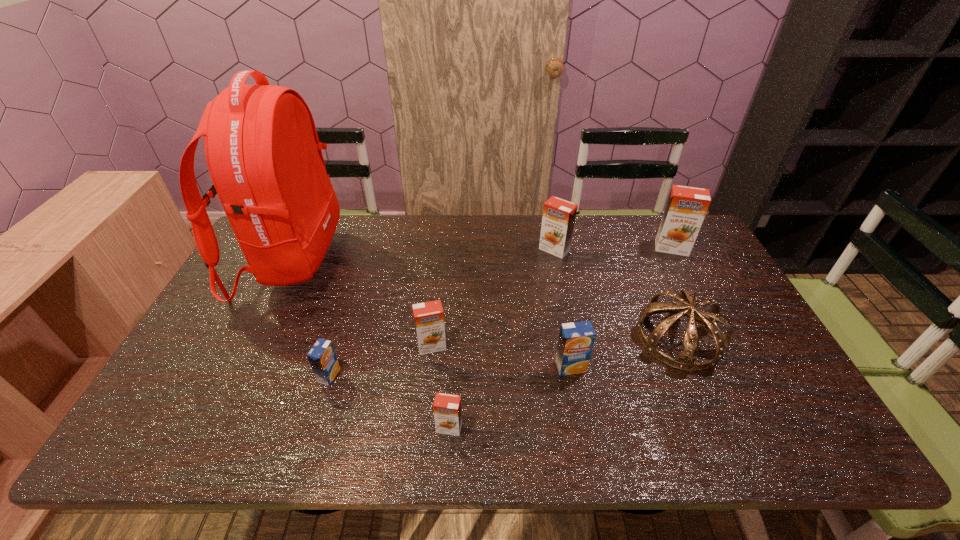
Find the location of a particular element. The width and height of the screenshot is (960, 540). empty space that is in between the second smallest orange orange juice and the nearest orange juice is located at coordinates (441, 387).

At what (x,y) coordinates should I click in order to perform the action: click on empty space that is in between the third farthest orange juice and the biggest orange orange juice. Please return your answer as a coordinate pair (x, y). The width and height of the screenshot is (960, 540). Looking at the image, I should click on (552, 297).

In order to click on empty space that is in between the brown tiara and the third orange orange juice from left to right in this screenshot , I will do `click(617, 294)`.

Point out which object is positioned as the third nearest to the nearest orange juice. Please provide its 2D coordinates. Your answer should be formatted as a tuple, i.e. [(x, y)], where the tuple contains the x and y coordinates of a point satisfying the conditions above.

[(322, 357)]

Identify which object is located as the seventh nearest to the right blue orange_juice. Please provide its 2D coordinates. Your answer should be formatted as a tuple, i.e. [(x, y)], where the tuple contains the x and y coordinates of a point satisfying the conditions above.

[(262, 149)]

Locate which orange juice is the third closest to the leftmost object. Please provide its 2D coordinates. Your answer should be formatted as a tuple, i.e. [(x, y)], where the tuple contains the x and y coordinates of a point satisfying the conditions above.

[(447, 409)]

Find the location of `the fourth closest orange juice to the red backpack`. the fourth closest orange juice to the red backpack is located at coordinates pos(558,220).

Identify which orange orange juice is located as the second nearest to the second nearest orange orange juice. Please provide its 2D coordinates. Your answer should be formatted as a tuple, i.e. [(x, y)], where the tuple contains the x and y coordinates of a point satisfying the conditions above.

[(558, 220)]

Locate an element on the screen. the fourth closest orange orange juice to the right blue orange_juice is located at coordinates [686, 207].

Where is `vacant region that satisfies the following two spatial constraints: 1. on the main compartment of the tallest object; 2. on the back side of the brown tiara`? The image size is (960, 540). vacant region that satisfies the following two spatial constraints: 1. on the main compartment of the tallest object; 2. on the back side of the brown tiara is located at coordinates (253, 338).